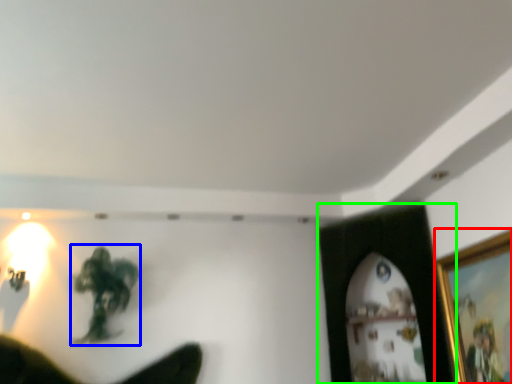
Question: Considering the real-world distances, which object is closest to picture frame (highlighted by a red box)? person (highlighted by a blue box) or picture frame (highlighted by a green box).

Choices:
 (A) person
 (B) picture frame

Answer: (B)